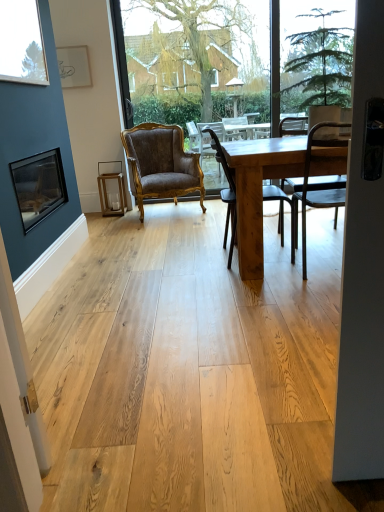
At what (x,y) coordinates should I click in order to perform the action: click on free space in front of black metal chair at right, the 1th chair positioned from the front. Please return your answer as a coordinate pair (x, y). This screenshot has width=384, height=512. Looking at the image, I should click on (309, 298).